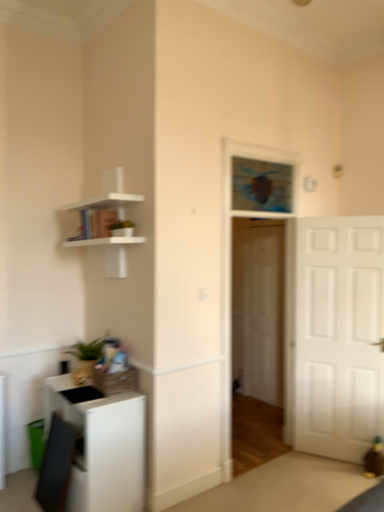
The image size is (384, 512). What do you see at coordinates (263, 313) in the screenshot? I see `white wooden door at center, which is the first door from back to front` at bounding box center [263, 313].

Describe the element at coordinates (107, 223) in the screenshot. The height and width of the screenshot is (512, 384). I see `white matte shelf at upper left` at that location.

What do you see at coordinates (102, 447) in the screenshot? Image resolution: width=384 pixels, height=512 pixels. I see `white matte cabinet at lower left` at bounding box center [102, 447].

At what (x,y) coordinates should I click in order to perform the action: click on white wooden door at center, which is the first door from back to front. Please return your answer as a coordinate pair (x, y). This screenshot has height=512, width=384. Looking at the image, I should click on (263, 313).

Does white wooden door at center, which is the first door from back to front, have a larger size compared to white matte cabinet at lower left?

No, white wooden door at center, which is the first door from back to front, is not bigger than white matte cabinet at lower left.

Between white wooden door at center, which is the 2th door from front to back, and white matte cabinet at lower left, which one has smaller width?

white wooden door at center, which is the 2th door from front to back.

From a real-world perspective, which object stands above the other?

white wooden door at center, which is the first door from back to front, is physically above.

Is there a large distance between white wooden door at center, which is the 2th door from front to back, and white matte cabinet at lower left?

white wooden door at center, which is the 2th door from front to back, is far away from white matte cabinet at lower left.

Which object is positioned more to the left, white matte door at right, which is the second door in back-to-front order, or blue glass window at center?

blue glass window at center.

From a real-world perspective, is white matte door at right, acting as the 1th door starting from the front, positioned above or below blue glass window at center?

white matte door at right, acting as the 1th door starting from the front, is below blue glass window at center.

From the image's perspective, which is below, white matte door at right, acting as the 1th door starting from the front, or blue glass window at center?

From the image's view, white matte door at right, acting as the 1th door starting from the front, is below.

Does blue glass window at center come behind white matte cabinet at lower left?

Yes, it is behind white matte cabinet at lower left.

From the image's perspective, would you say blue glass window at center is positioned over white matte cabinet at lower left?

Correct, blue glass window at center appears higher than white matte cabinet at lower left in the image.

Which of these two, blue glass window at center or white matte cabinet at lower left, stands shorter?

blue glass window at center.

Is white matte shelf at upper left in front of white matte door at right, acting as the 1th door starting from the front?

Yes, it is.

How different are the orientations of white matte shelf at upper left and white matte door at right, acting as the 1th door starting from the front, in degrees?

They differ by 24.4 degrees in their facing directions.

From the image's perspective, relative to white matte door at right, which is the second door in back-to-front order, is white matte shelf at upper left above or below?

white matte shelf at upper left is situated higher than white matte door at right, which is the second door in back-to-front order, in the image.

Measure the distance between white matte shelf at upper left and white matte door at right, which is the second door in back-to-front order.

white matte shelf at upper left and white matte door at right, which is the second door in back-to-front order, are 5.71 feet apart.

Is white matte cabinet at lower left positioned far away from white wooden door at center, which is the first door from back to front?

Yes, white matte cabinet at lower left and white wooden door at center, which is the first door from back to front, are quite far apart.

In order to click on the 2nd door behind the white matte cabinet at lower left in this screenshot , I will do `click(263, 313)`.

Is white matte door at right, acting as the 1th door starting from the front, behind white matte cabinet at lower left?

Yes, white matte door at right, acting as the 1th door starting from the front, is behind white matte cabinet at lower left.

From a real-world perspective, does white matte door at right, acting as the 1th door starting from the front, sit lower than white matte cabinet at lower left?

No, from a real-world perspective, white matte door at right, acting as the 1th door starting from the front, is not under white matte cabinet at lower left.

Does white matte door at right, acting as the 1th door starting from the front, appear on the right side of white matte cabinet at lower left?

Correct, you'll find white matte door at right, acting as the 1th door starting from the front, to the right of white matte cabinet at lower left.

Which of these two, white wooden door at center, which is the first door from back to front, or white matte door at right, which is the second door in back-to-front order, stands shorter?

white matte door at right, which is the second door in back-to-front order, is shorter.

Can you confirm if white wooden door at center, which is the 2th door from front to back, is bigger than white matte door at right, acting as the 1th door starting from the front?

No, white wooden door at center, which is the 2th door from front to back, is not bigger than white matte door at right, acting as the 1th door starting from the front.

From the picture: Which object is wider, white wooden door at center, which is the first door from back to front, or white matte door at right, which is the second door in back-to-front order?

white matte door at right, which is the second door in back-to-front order, is wider.

Does white wooden door at center, which is the 2th door from front to back, turn towards white matte door at right, acting as the 1th door starting from the front?

No.

I want to click on cabinetry located on the left of white wooden door at center, which is the first door from back to front, so coord(102,447).

From the image's perspective, count 2nd doors downward from the blue glass window at center and point to it. Please provide its 2D coordinates.

[(334, 335)]

When comparing their distances from white matte shelf at upper left, does white matte cabinet at lower left or blue glass window at center seem further?

white matte cabinet at lower left is further to white matte shelf at upper left.

When comparing their distances from white wooden door at center, which is the first door from back to front, does white matte cabinet at lower left or white matte shelf at upper left seem closer?

white matte shelf at upper left.

In the scene shown: Estimate the real-world distances between objects in this image. Which object is closer to white matte door at right, acting as the 1th door starting from the front, white matte cabinet at lower left or white wooden door at center, which is the 2th door from front to back?

white wooden door at center, which is the 2th door from front to back, lies closer to white matte door at right, acting as the 1th door starting from the front, than the other object.

Looking at the image, which one is located further to blue glass window at center, white wooden door at center, which is the 2th door from front to back, or white matte door at right, which is the second door in back-to-front order?

white wooden door at center, which is the 2th door from front to back.

Estimate the real-world distances between objects in this image. Which object is closer to white matte cabinet at lower left, white matte door at right, acting as the 1th door starting from the front, or white wooden door at center, which is the 2th door from front to back?

The object closer to white matte cabinet at lower left is white matte door at right, acting as the 1th door starting from the front.

Which object lies nearer to the anchor point white wooden door at center, which is the first door from back to front, white matte door at right, which is the second door in back-to-front order, or white matte shelf at upper left?

The object closer to white wooden door at center, which is the first door from back to front, is white matte door at right, which is the second door in back-to-front order.

Considering their positions, is white matte door at right, acting as the 1th door starting from the front, positioned closer to blue glass window at center than white matte shelf at upper left?

white matte door at right, acting as the 1th door starting from the front, is positioned closer to the anchor blue glass window at center.

Which object lies nearer to the anchor point blue glass window at center, white wooden door at center, which is the 2th door from front to back, or white matte cabinet at lower left?

Among the two, white wooden door at center, which is the 2th door from front to back, is located nearer to blue glass window at center.

Where is `shelf located between white matte cabinet at lower left and white matte door at right, acting as the 1th door starting from the front, in the left-right direction`? shelf located between white matte cabinet at lower left and white matte door at right, acting as the 1th door starting from the front, in the left-right direction is located at coordinates (107, 223).

Find the location of a particular element. door between blue glass window at center and white wooden door at center, which is the first door from back to front, along the z-axis is located at coordinates (334, 335).

Locate an element on the screen. The image size is (384, 512). shelf between blue glass window at center and white matte cabinet at lower left from top to bottom is located at coordinates (107, 223).

Locate an element on the screen. door between white matte cabinet at lower left and white matte door at right, which is the second door in back-to-front order, from left to right is located at coordinates (263, 313).